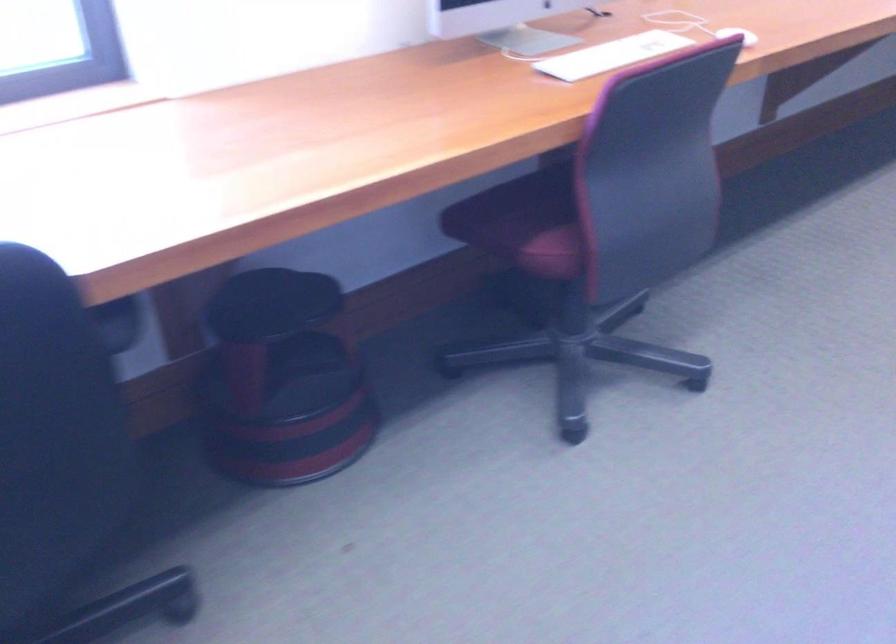
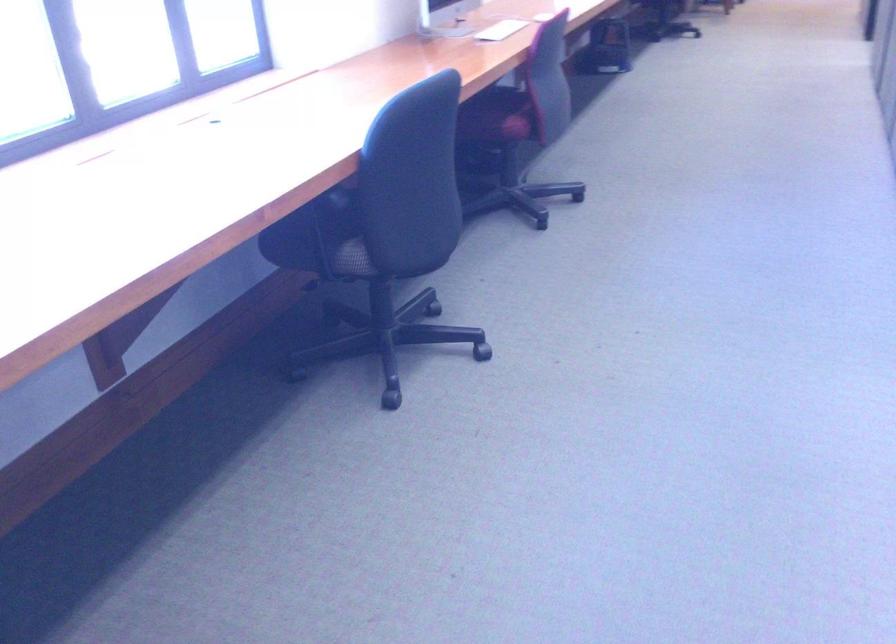
The point at (515, 234) is marked in the first image. Where is the corresponding point in the second image?

(497, 116)